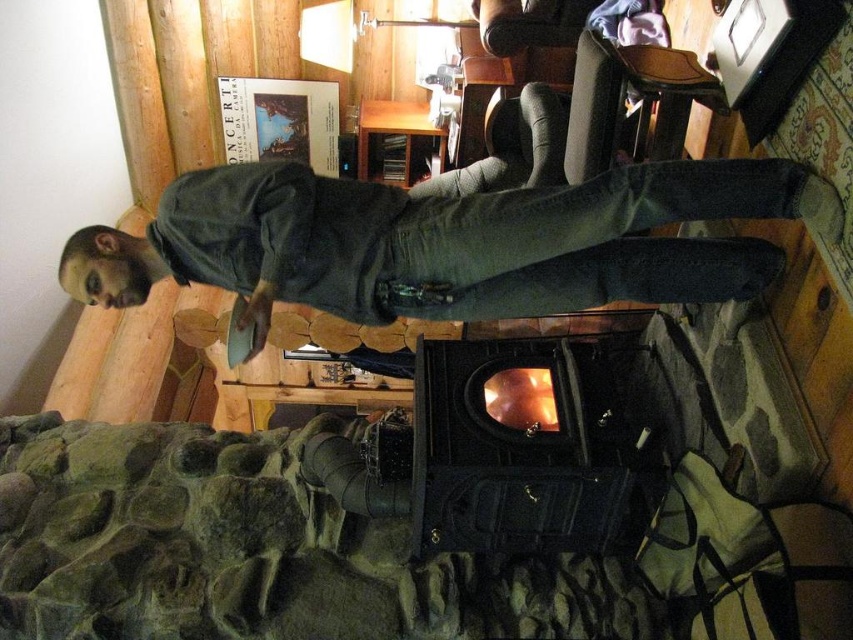
Who is lower down, dark green shirt at center or black cast iron fireplace at center?

black cast iron fireplace at center is below.

Can you confirm if dark green shirt at center is positioned above black cast iron fireplace at center?

Yes, dark green shirt at center is above black cast iron fireplace at center.

Who is more distant from viewer, (155, 260) or (625, 369)?

Positioned behind is point (625, 369).

Where is `dark green shirt at center`? The width and height of the screenshot is (853, 640). dark green shirt at center is located at coordinates (450, 241).